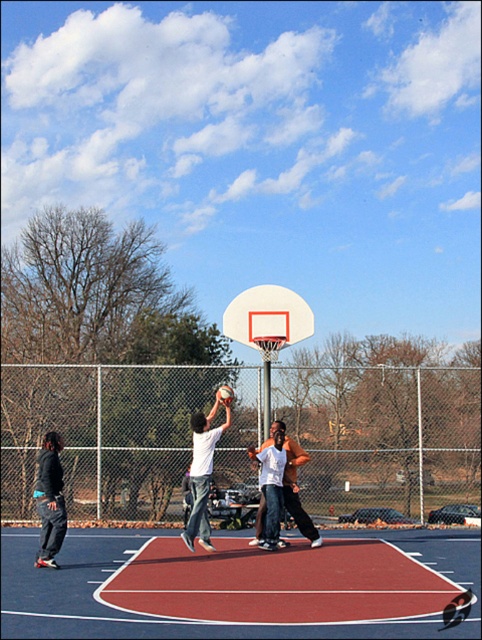
Question: Which object is closer to the camera taking this photo?

Choices:
 (A) white matte basketball at center
 (B) white matte basketball hoop at center
 (C) rubberized red basketball court at center

Answer: (C)

Question: Which of the following is the farthest from the observer?

Choices:
 (A) (318, 534)
 (B) (186, 588)

Answer: (A)

Question: Which point appears closest to the camera in this image?

Choices:
 (A) (298, 448)
 (B) (197, 484)

Answer: (B)

Question: Does white matte basketball at center appear on the right side of dark gray hoodie at left?

Choices:
 (A) no
 (B) yes

Answer: (B)

Question: Observing the image, what is the correct spatial positioning of rubberized red basketball court at center in reference to white matte basketball hoop at center?

Choices:
 (A) above
 (B) below

Answer: (B)

Question: Does white matte basketball at center have a smaller size compared to dark gray hoodie at left?

Choices:
 (A) yes
 (B) no

Answer: (B)